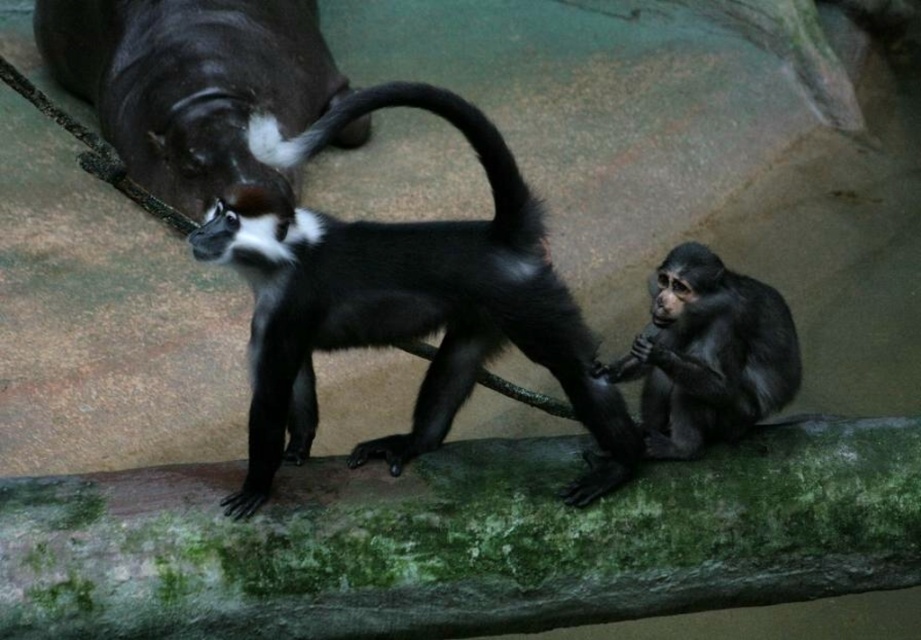
You are a zookeeper observing the monkeys in their enclosure. You notice the black glossy monkey at center and the black glossy tail at center. Which one is closer to you?

The black glossy monkey at center is closer to you because it is in front of the black glossy tail at center.

You are a zookeeper standing at the origin point of the enclosure. You need to locate the black glossy monkey at center. What are the coordinates where you should look to find it?

The black glossy monkey at center is located at coordinates point (401, 301).

You are standing in front of the image of two monkeys on a mossy branch. There is a point at coordinates point (674, 282). If you want to touch that point with a stick that is 8 feet long, will the stick reach it?

The distance between point (674, 282) and the viewer is 9.02 feet. Since the stick is only 8 feet long, it will not reach the point.